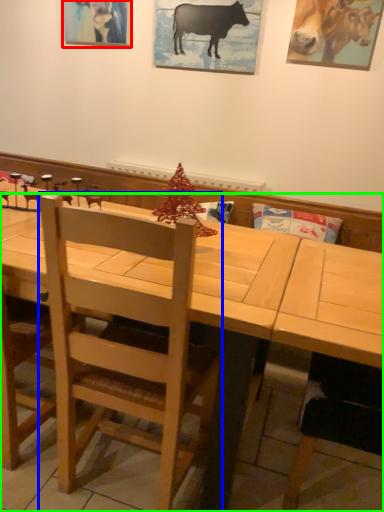
Question: Which object is positioned farthest from picture frame (highlighted by a red box)? Select from chair (highlighted by a blue box) and table (highlighted by a green box).

Choices:
 (A) chair
 (B) table

Answer: (A)